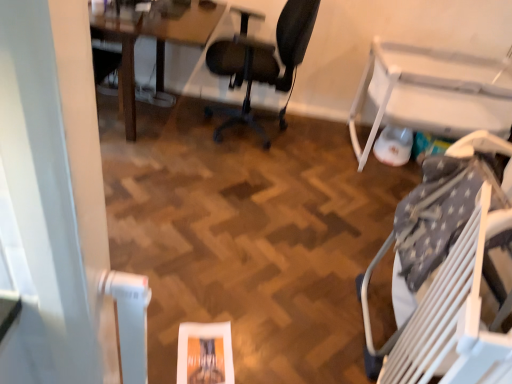
Locate an element on the screen. free space in front of black mesh office chair at center, acting as the second chair starting from the right is located at coordinates (225, 174).